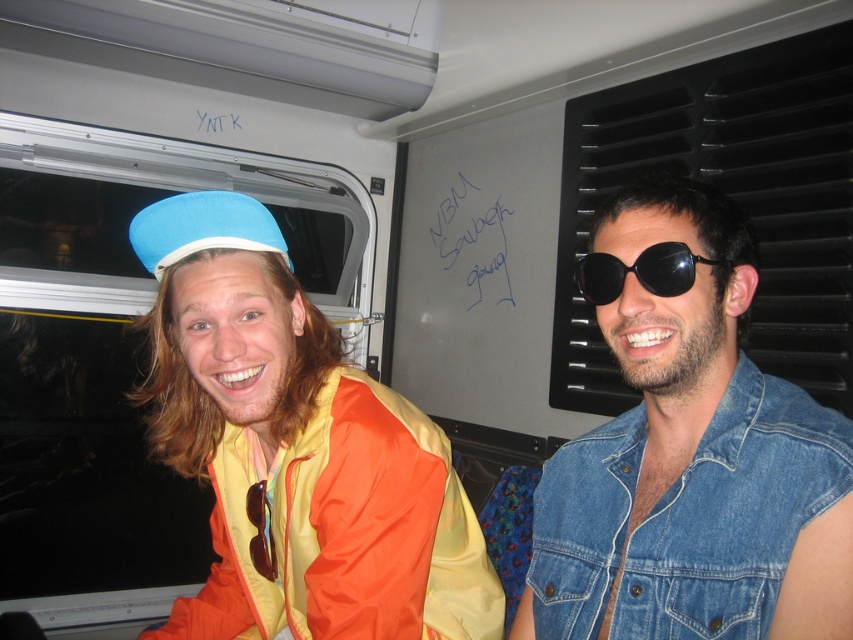
Question: Can you confirm if faded denim jacket at lower right is bigger than black reflective sunglasses at right?

Choices:
 (A) no
 (B) yes

Answer: (B)

Question: Does matte blue fabric hat at left appear on the left side of black reflective sunglasses at right?

Choices:
 (A) yes
 (B) no

Answer: (A)

Question: Considering the relative positions of faded denim jacket at lower right and matte blue fabric hat at left in the image provided, where is faded denim jacket at lower right located with respect to matte blue fabric hat at left?

Choices:
 (A) below
 (B) above

Answer: (A)

Question: Which is nearer to the faded denim jacket at lower right?

Choices:
 (A) matte blue hat at left
 (B) matte blue fabric hat at left
 (C) black reflective sunglasses at right

Answer: (C)

Question: Which of these objects is positioned farthest from the matte blue fabric hat at left?

Choices:
 (A) matte blue hat at left
 (B) faded denim jacket at lower right
 (C) black reflective sunglasses at right

Answer: (B)

Question: Which point is closer to the camera taking this photo?

Choices:
 (A) (263, 237)
 (B) (743, 410)
 (C) (202, 189)

Answer: (B)